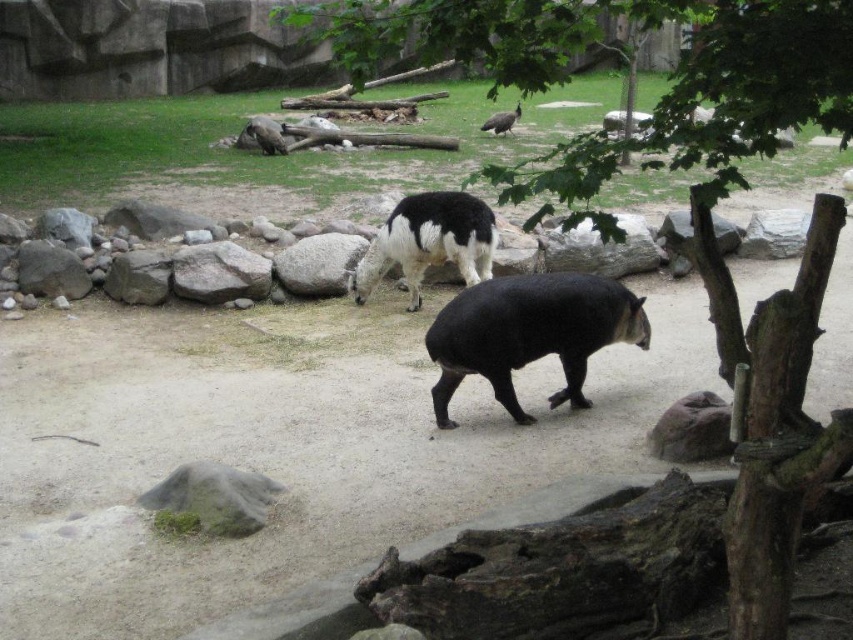
Question: Is black smooth tapir at center to the right of brown fur bird at upper center from the viewer's perspective?

Choices:
 (A) yes
 (B) no

Answer: (B)

Question: Where is white woolen llama at center located in relation to white woolen llama at upper center in the image?

Choices:
 (A) right
 (B) left

Answer: (A)

Question: Among these points, which one is farthest from the camera?

Choices:
 (A) (447, 243)
 (B) (730, 49)
 (C) (502, 125)
 (D) (248, 129)

Answer: (C)

Question: Based on their relative distances, which object is farther from the white woolen llama at center?

Choices:
 (A) black smooth tapir at center
 (B) brown fur bird at upper center
 (C) white woolen llama at upper center
 (D) green leafy tree at upper center

Answer: (B)

Question: Which of the following is the closest to the observer?

Choices:
 (A) (247, 132)
 (B) (486, 252)
 (C) (508, 112)
 (D) (436, 390)

Answer: (D)

Question: Is black smooth tapir at center below white woolen llama at center?

Choices:
 (A) yes
 (B) no

Answer: (A)